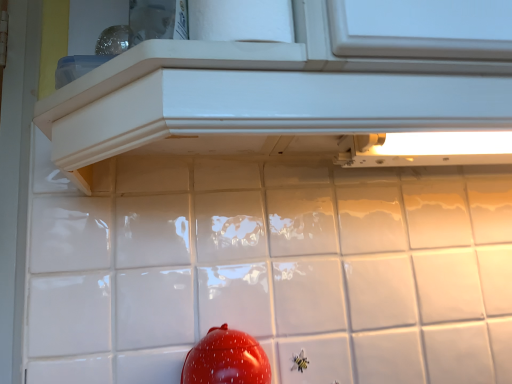
Question: Is white glossy cabinet at upper center bigger or smaller than glossy red tomato at lower center?

Choices:
 (A) small
 (B) big

Answer: (B)

Question: Relative to glossy red tomato at lower center, is white glossy cabinet at upper center in front or behind?

Choices:
 (A) behind
 (B) front

Answer: (B)

Question: In terms of height, does white glossy cabinet at upper center look taller or shorter compared to glossy red tomato at lower center?

Choices:
 (A) short
 (B) tall

Answer: (A)

Question: Is point pos(268,367) positioned closer to the camera than point pos(279,92)?

Choices:
 (A) farther
 (B) closer

Answer: (A)

Question: From their relative heights in the image, would you say glossy red tomato at lower center is taller or shorter than white glossy cabinet at upper center?

Choices:
 (A) tall
 (B) short

Answer: (A)

Question: Relative to white glossy cabinet at upper center, is glossy red tomato at lower center in front or behind?

Choices:
 (A) front
 (B) behind

Answer: (B)

Question: Based on their sizes in the image, would you say glossy red tomato at lower center is bigger or smaller than white glossy cabinet at upper center?

Choices:
 (A) small
 (B) big

Answer: (A)